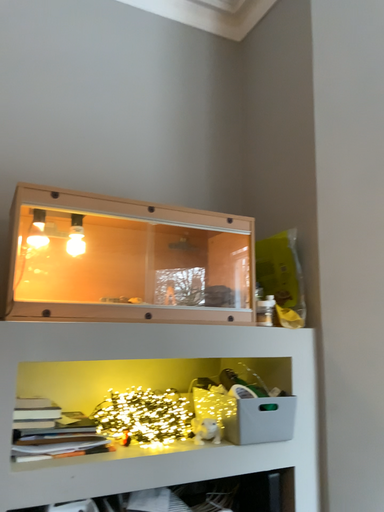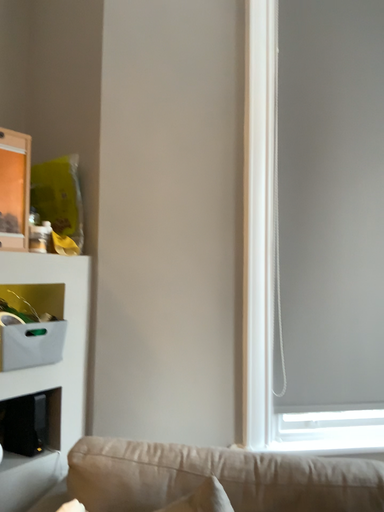
Question: Which way did the camera rotate in the video?

Choices:
 (A) rotated right
 (B) rotated left

Answer: (A)